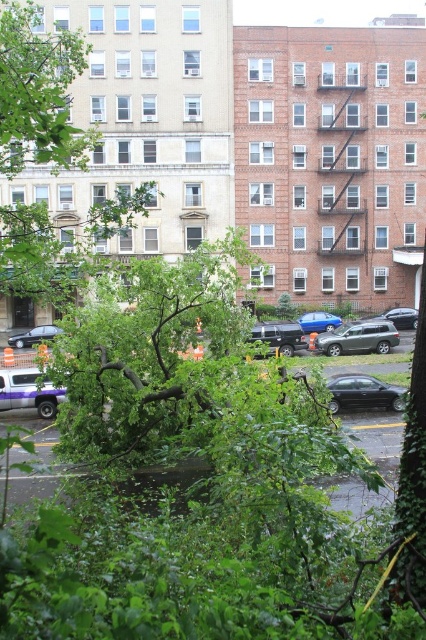
Question: Observing the image, what is the correct spatial positioning of green leafy tree at upper left in reference to satin silver suv at center?

Choices:
 (A) below
 (B) above

Answer: (B)

Question: Which object is the farthest from the green leafy tree at upper left?

Choices:
 (A) metallic silver suv at center
 (B) shiny black sedan at center
 (C) satin silver suv at center

Answer: (C)

Question: Is satin silver suv at center below metallic silver suv at center?

Choices:
 (A) yes
 (B) no

Answer: (A)

Question: Estimate the real-world distances between objects in this image. Which object is farther from the purple matte truck at lower left?

Choices:
 (A) shiny silver sedan at lower left
 (B) metallic silver suv at center
 (C) green leafy tree at upper left

Answer: (B)

Question: Which point is closer to the camera?

Choices:
 (A) (28, 372)
 (B) (25, 342)
 (C) (328, 314)

Answer: (A)

Question: Does green leafy tree at upper left appear over metallic silver suv at center?

Choices:
 (A) no
 (B) yes

Answer: (B)